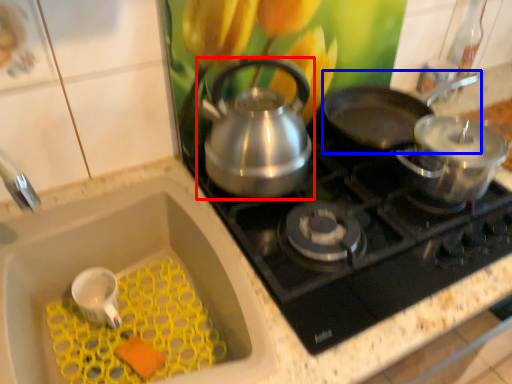
Question: Which object appears closest to the camera in this image, kettle (highlighted by a red box) or frying pan (highlighted by a blue box)?

Choices:
 (A) kettle
 (B) frying pan

Answer: (A)